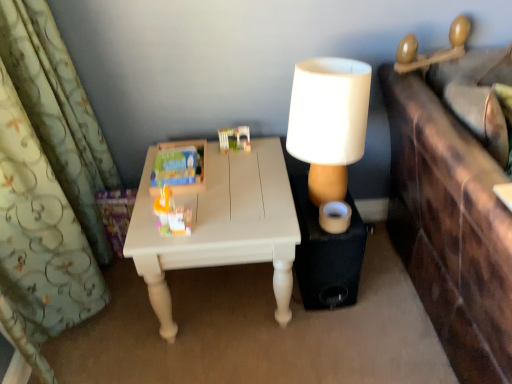
Locate an element on the screen. Image resolution: width=512 pixels, height=384 pixels. plastic building blocks at center, which is counted as the 3th toy, starting from the left is located at coordinates (234, 139).

This screenshot has width=512, height=384. What do you see at coordinates (234, 139) in the screenshot?
I see `plastic building blocks at center, which is counted as the 3th toy, starting from the left` at bounding box center [234, 139].

Find the location of `green floral fabric curtain at left`. green floral fabric curtain at left is located at coordinates (47, 186).

Where is `white matte lampshade at upper right`? Image resolution: width=512 pixels, height=384 pixels. white matte lampshade at upper right is located at coordinates (329, 129).

Identify the location of black matte speaker at lower right. (326, 253).

Describe the element at coordinates (172, 215) in the screenshot. I see `translucent plastic toy at center, which is the 2th toy in right-to-left order` at that location.

The image size is (512, 384). Describe the element at coordinates (177, 167) in the screenshot. I see `matte plastic toy at center, which is the 3th toy in right-to-left order` at that location.

Image resolution: width=512 pixels, height=384 pixels. I want to click on plastic building blocks at center, which ranks as the first toy in right-to-left order, so click(234, 139).

From the image's perspective, is plastic building blocks at center, which is counted as the 3th toy, starting from the left, located beneath white painted wood table at center?

No, from the image's perspective, plastic building blocks at center, which is counted as the 3th toy, starting from the left, is not below white painted wood table at center.

In the scene shown: Is white painted wood table at center located within plastic building blocks at center, which ranks as the first toy in right-to-left order?

No, white painted wood table at center is not a part of plastic building blocks at center, which ranks as the first toy in right-to-left order.

Is plastic building blocks at center, which is counted as the 3th toy, starting from the left, shorter than white painted wood table at center?

Indeed, plastic building blocks at center, which is counted as the 3th toy, starting from the left, has a lesser height compared to white painted wood table at center.

At what (x,y) coordinates should I click in order to perform the action: click on table on the left of plastic building blocks at center, which ranks as the first toy in right-to-left order. Please return your answer as a coordinate pair (x, y). The image size is (512, 384). Looking at the image, I should click on (221, 225).

Considering the sizes of white painted wood table at center and green floral fabric curtain at left in the image, is white painted wood table at center wider or thinner than green floral fabric curtain at left?

In the image, white painted wood table at center appears to be wider than green floral fabric curtain at left.

Which is farther, (154,217) or (82,158)?

The point (82,158) is behind.

Where is `table located behind the green floral fabric curtain at left`? table located behind the green floral fabric curtain at left is located at coordinates (x=221, y=225).

Is white painted wood table at center turned away from green floral fabric curtain at left?

No, white painted wood table at center's orientation is not away from green floral fabric curtain at left.

Does translucent plastic toy at center, which is the 2th toy in right-to-left order, have a lesser width compared to white painted wood table at center?

Indeed, translucent plastic toy at center, which is the 2th toy in right-to-left order, has a lesser width compared to white painted wood table at center.

Does translucent plastic toy at center, which appears as the 2th toy when viewed from the left, turn towards white painted wood table at center?

No, translucent plastic toy at center, which appears as the 2th toy when viewed from the left, is not turned towards white painted wood table at center.

In terms of height, does translucent plastic toy at center, which is the 2th toy in right-to-left order, look taller or shorter compared to white painted wood table at center?

Considering their sizes, translucent plastic toy at center, which is the 2th toy in right-to-left order, has less height than white painted wood table at center.

Is white painted wood table at center a part of translucent plastic toy at center, which appears as the 2th toy when viewed from the left?

No, white painted wood table at center is not surrounded by translucent plastic toy at center, which appears as the 2th toy when viewed from the left.

From a real-world perspective, is white matte lampshade at upper right physically below white painted wood table at center?

Incorrect, from a real-world perspective, white matte lampshade at upper right is higher than white painted wood table at center.

Would you say white matte lampshade at upper right is outside white painted wood table at center?

That's correct, white matte lampshade at upper right is outside of white painted wood table at center.

Which is more to the left, white matte lampshade at upper right or white painted wood table at center?

white painted wood table at center is more to the left.

Where is `table that is on the left side of white matte lampshade at upper right`? The image size is (512, 384). table that is on the left side of white matte lampshade at upper right is located at coordinates (221, 225).

Looking at this image, is black matte speaker at lower right inside or outside of green floral fabric curtain at left?

black matte speaker at lower right cannot be found inside green floral fabric curtain at left.

Which is behind, point (309, 243) or point (48, 78)?

The point (309, 243) is behind.

From a real-world perspective, is black matte speaker at lower right below green floral fabric curtain at left?

Yes, from a real-world perspective, black matte speaker at lower right is beneath green floral fabric curtain at left.

Based on their sizes in the image, would you say black matte speaker at lower right is bigger or smaller than green floral fabric curtain at left?

black matte speaker at lower right is smaller than green floral fabric curtain at left.

Considering the sizes of objects brown leather vanity at right and translucent plastic toy at center, which appears as the 2th toy when viewed from the left, in the image provided, who is thinner, brown leather vanity at right or translucent plastic toy at center, which appears as the 2th toy when viewed from the left,?

translucent plastic toy at center, which appears as the 2th toy when viewed from the left, is thinner.

The image size is (512, 384). What are the coordinates of `vanity on the right of translucent plastic toy at center, which appears as the 2th toy when viewed from the left` in the screenshot? It's located at (450, 228).

Who is shorter, brown leather vanity at right or translucent plastic toy at center, which is the 2th toy in right-to-left order?

With less height is translucent plastic toy at center, which is the 2th toy in right-to-left order.

In the scene shown: Is white matte lampshade at upper right facing towards black matte speaker at lower right?

No, white matte lampshade at upper right is not turned towards black matte speaker at lower right.

From a real-world perspective, is white matte lampshade at upper right on black matte speaker at lower right?

Yes, from a real-world perspective, white matte lampshade at upper right is over black matte speaker at lower right

How different are the orientations of white matte lampshade at upper right and black matte speaker at lower right in degrees?

The angular difference between white matte lampshade at upper right and black matte speaker at lower right is 2.05 degrees.

Find the location of a particular element. The height and width of the screenshot is (384, 512). side table below the white matte lampshade at upper right (from the image's perspective) is located at coordinates (326, 253).

From a real-world perspective, starting from the white painted wood table at center, which toy is the 2nd one vertically above it? Please provide its 2D coordinates.

[(234, 139)]

This screenshot has width=512, height=384. Identify the location of curtain on the left of white painted wood table at center. (47, 186).

Looking at the image, which one is located closer to brown leather vanity at right, white painted wood table at center or white matte lampshade at upper right?

white matte lampshade at upper right is positioned closer to the anchor brown leather vanity at right.

Based on their spatial positions, is black matte speaker at lower right or white painted wood table at center further from translucent plastic toy at center, which appears as the 2th toy when viewed from the left?

black matte speaker at lower right is further to translucent plastic toy at center, which appears as the 2th toy when viewed from the left.

Estimate the real-world distances between objects in this image. Which object is closer to green floral fabric curtain at left, plastic building blocks at center, which is counted as the 3th toy, starting from the left, or white painted wood table at center?

Among the two, white painted wood table at center is located nearer to green floral fabric curtain at left.

Which object lies nearer to the anchor point brown leather vanity at right, white matte lampshade at upper right or plastic building blocks at center, which is counted as the 3th toy, starting from the left?

Based on the image, white matte lampshade at upper right appears to be nearer to brown leather vanity at right.

When comparing their distances from white painted wood table at center, does brown leather vanity at right or green floral fabric curtain at left seem further?

brown leather vanity at right.

Consider the image. Estimate the real-world distances between objects in this image. Which object is closer to translucent plastic toy at center, which is the 2th toy in right-to-left order, black matte speaker at lower right or white matte lampshade at upper right?

white matte lampshade at upper right lies closer to translucent plastic toy at center, which is the 2th toy in right-to-left order, than the other object.

Which object lies nearer to the anchor point white matte lampshade at upper right, black matte speaker at lower right or green floral fabric curtain at left?

Among the two, black matte speaker at lower right is located nearer to white matte lampshade at upper right.

Estimate the real-world distances between objects in this image. Which object is further from brown leather vanity at right, translucent plastic toy at center, which is the 2th toy in right-to-left order, or matte plastic toy at center, positioned as the 1th toy in left-to-right order?

The object further to brown leather vanity at right is matte plastic toy at center, positioned as the 1th toy in left-to-right order.

Locate an element on the screen. lamp situated between translucent plastic toy at center, which is the 2th toy in right-to-left order, and black matte speaker at lower right from left to right is located at coordinates (329, 129).

Find the location of a particular element. The height and width of the screenshot is (384, 512). table situated between matte plastic toy at center, which is the 3th toy in right-to-left order, and brown leather vanity at right from left to right is located at coordinates (221, 225).

Locate an element on the screen. lamp between plastic building blocks at center, which is counted as the 3th toy, starting from the left, and white painted wood table at center, in the vertical direction is located at coordinates (329, 129).

Find the location of a particular element. toy positioned between green floral fabric curtain at left and matte plastic toy at center, which is the 3th toy in right-to-left order, from near to far is located at coordinates (172, 215).